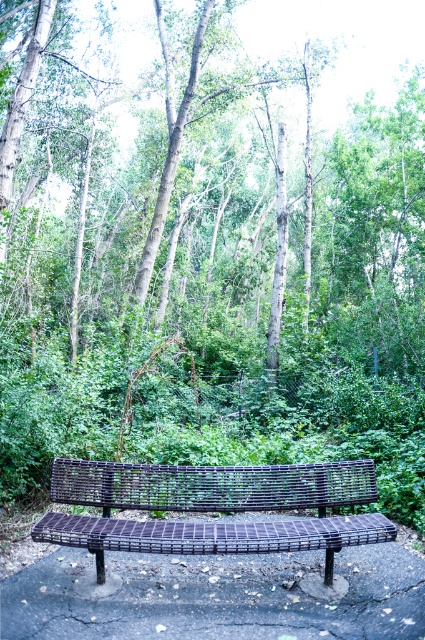
Question: Does green leafy tree at center have a smaller size compared to metallic woven bench at center?

Choices:
 (A) no
 (B) yes

Answer: (A)

Question: Does green leafy tree at center have a greater width compared to metallic woven bench at center?

Choices:
 (A) yes
 (B) no

Answer: (A)

Question: Is green leafy tree at center further to the viewer compared to metallic woven bench at center?

Choices:
 (A) yes
 (B) no

Answer: (A)

Question: Among these objects, which one is farthest from the camera?

Choices:
 (A) green leafy tree at center
 (B) metallic woven bench at center

Answer: (A)